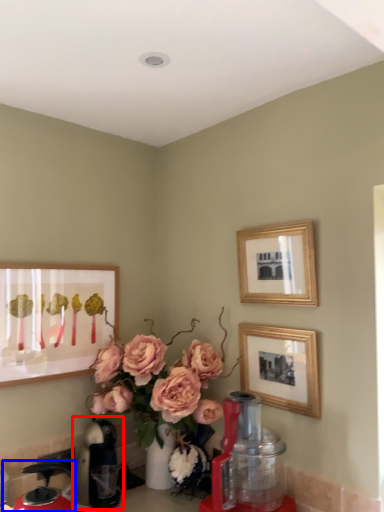
Question: Which of the following is the farthest to the observer, coffeepot (highlighted by a red box) or coffeepot (highlighted by a blue box)?

Choices:
 (A) coffeepot
 (B) coffeepot

Answer: (A)